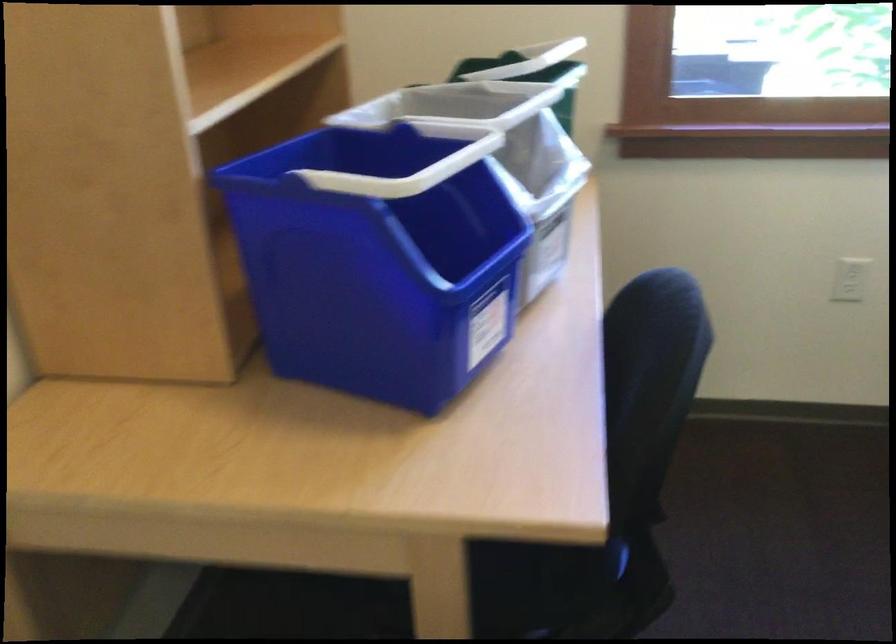
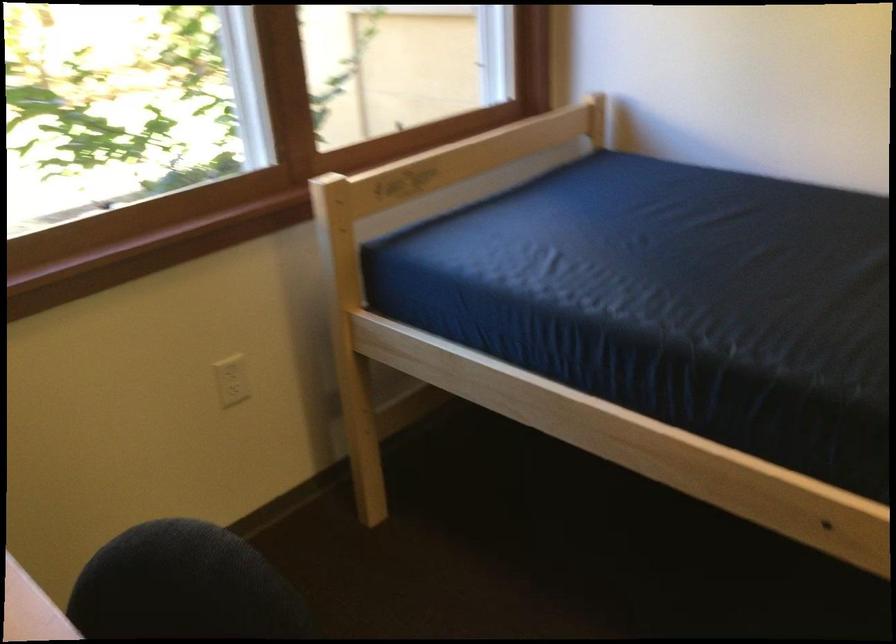
Question: The images are taken continuously from a first-person perspective. In which direction is your viewpoint rotating?

Choices:
 (A) Left
 (B) Right
 (C) Up
 (D) Down

Answer: (B)